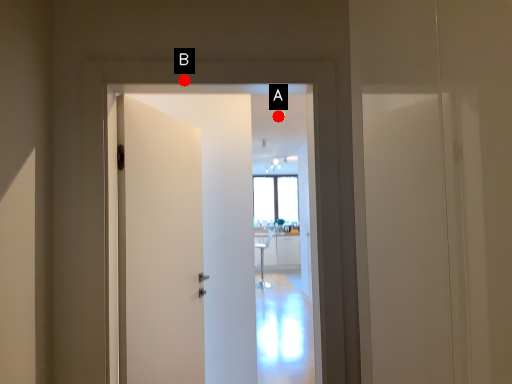
Question: Two points are circled on the image, labeled by A and B beside each circle. Which point is closer to the camera?

Choices:
 (A) A is closer
 (B) B is closer

Answer: (B)